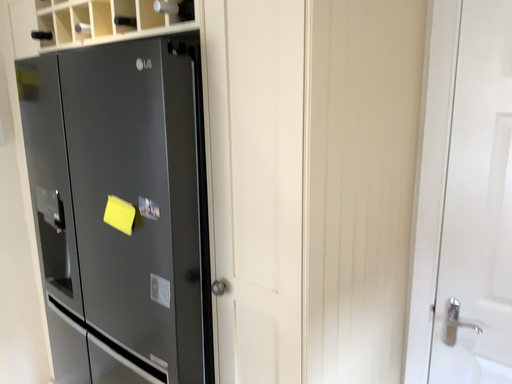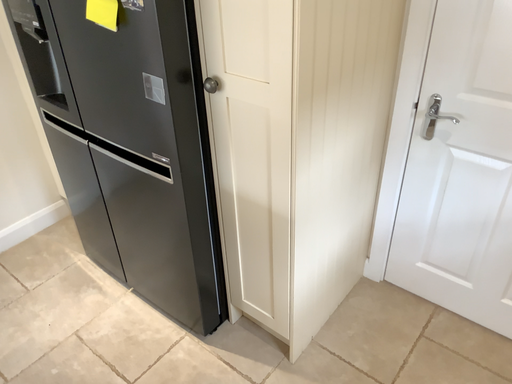
Question: How did the camera likely rotate when shooting the video?

Choices:
 (A) rotated downward
 (B) rotated upward

Answer: (A)